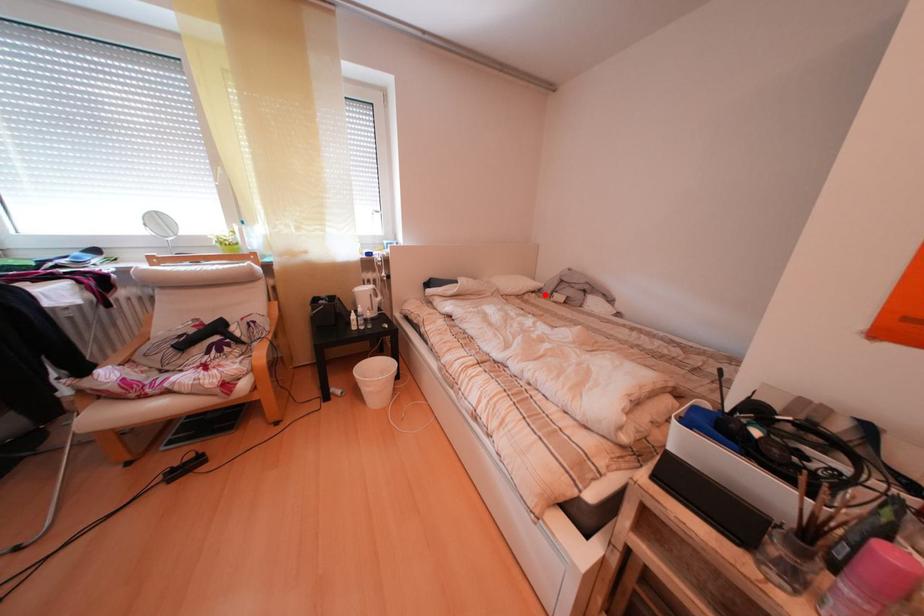
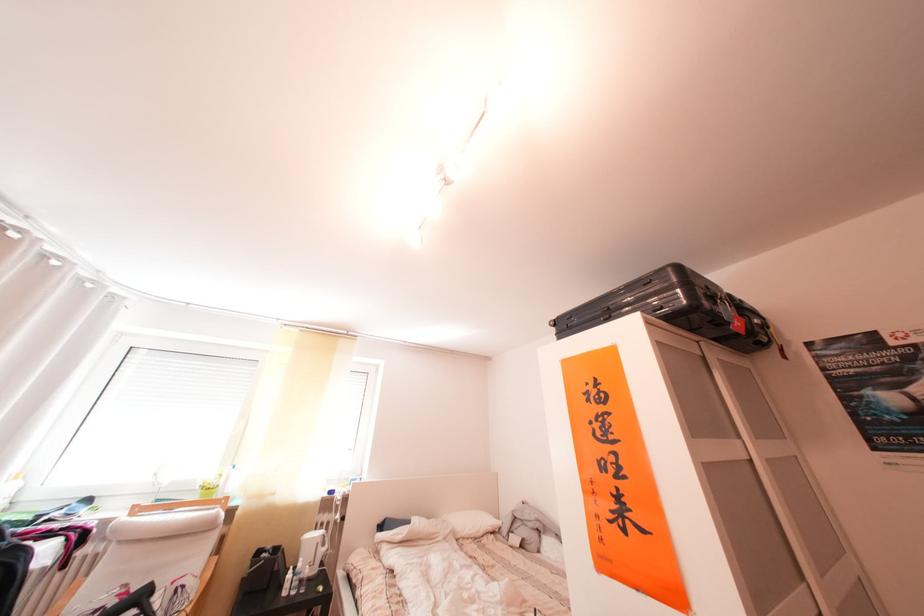
The point at the highlighted location is marked in the first image. Where is the corresponding point in the second image?

(504, 535)